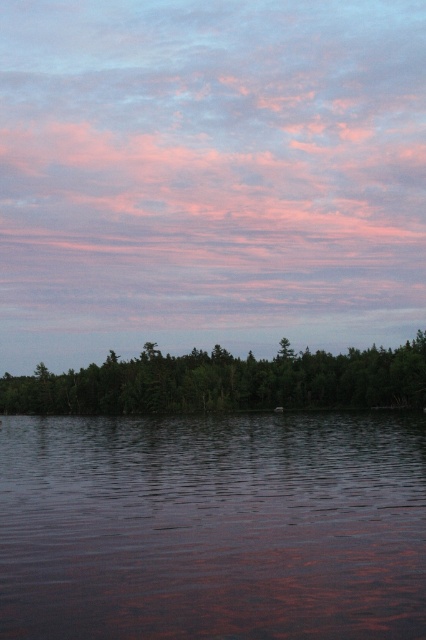
Question: Is smooth dark water at center to the right of green matte tree at lower center from the viewer's perspective?

Choices:
 (A) no
 (B) yes

Answer: (B)

Question: Which point is farther to the camera?

Choices:
 (A) green matte tree at lower center
 (B) pink fluffy clouds at upper center

Answer: (B)

Question: Among these objects, which one is farthest from the camera?

Choices:
 (A) smooth dark water at center
 (B) pink fluffy clouds at upper center

Answer: (B)

Question: Does smooth dark water at center appear on the left side of green matte tree at lower center?

Choices:
 (A) yes
 (B) no

Answer: (B)

Question: Estimate the real-world distances between objects in this image. Which object is closer to the green matte tree at lower center?

Choices:
 (A) pink fluffy clouds at upper center
 (B) smooth dark water at center

Answer: (B)

Question: Observing the image, what is the correct spatial positioning of pink fluffy clouds at upper center in reference to smooth dark water at center?

Choices:
 (A) left
 (B) right

Answer: (A)